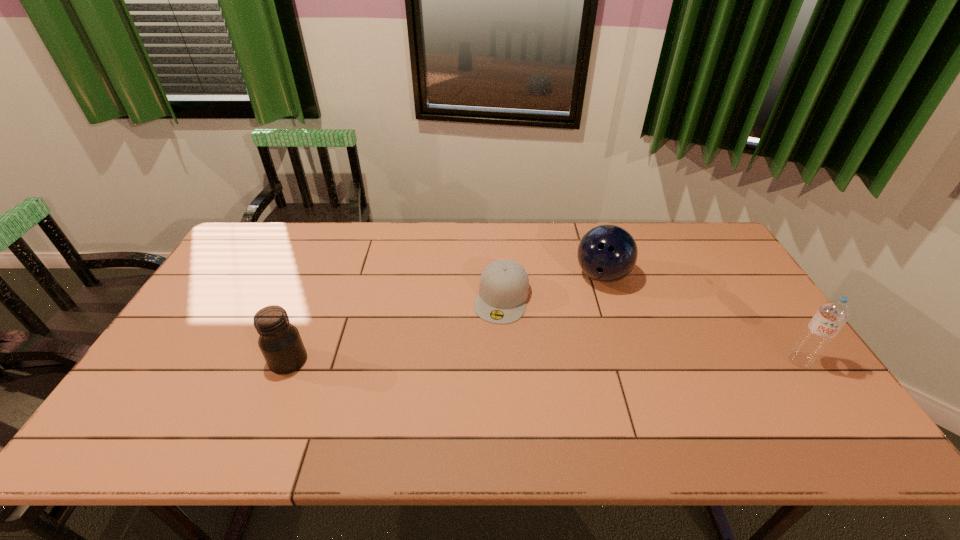
Where is `free location at the far right corner of the desktop`? The width and height of the screenshot is (960, 540). free location at the far right corner of the desktop is located at coordinates (684, 237).

Locate an element on the screen. The width and height of the screenshot is (960, 540). vacant space at the near right corner is located at coordinates (777, 407).

Where is `vacant area between the water bottle and the bowling ball`? This screenshot has height=540, width=960. vacant area between the water bottle and the bowling ball is located at coordinates (701, 318).

Find the location of a particular element. free space between the shortest object and the second object from right to left is located at coordinates [x=552, y=287].

Locate an element on the screen. vacant space that is in between the bowling ball and the shortest object is located at coordinates (552, 287).

Find the location of `vacant region between the bowling ball and the cap`. vacant region between the bowling ball and the cap is located at coordinates (552, 287).

Locate an element on the screen. This screenshot has width=960, height=540. vacant space that is in between the bowling ball and the tallest object is located at coordinates (701, 318).

Identify the location of free point between the jar and the bowling ball. (445, 318).

Image resolution: width=960 pixels, height=540 pixels. What are the coordinates of `vacant point located between the third object from right to left and the water bottle` in the screenshot? It's located at (651, 329).

Identify the location of blank region between the third object from right to left and the leftmost object. (396, 329).